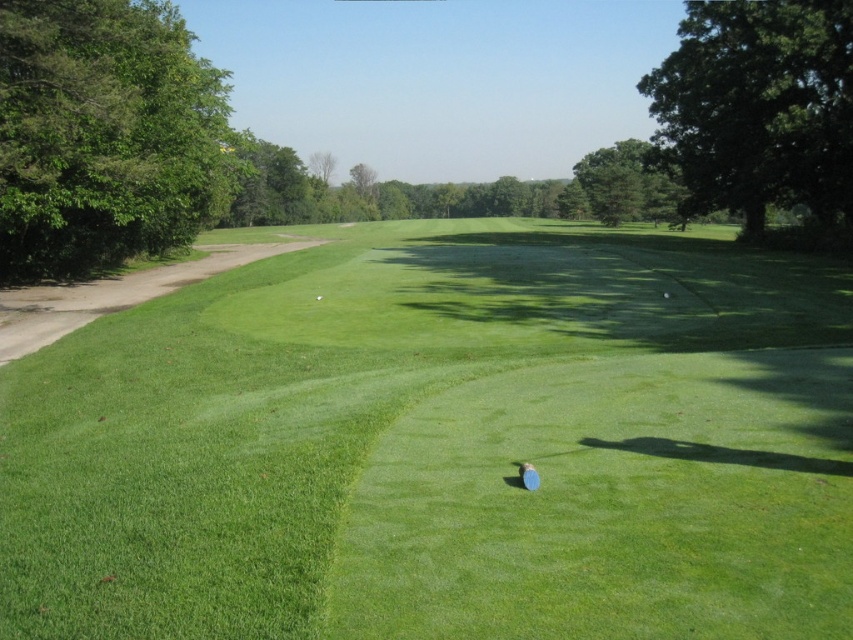
Question: Among these points, which one is farthest from the camera?

Choices:
 (A) (315, 298)
 (B) (741, 317)

Answer: (A)

Question: Which point appears closest to the camera in this image?

Choices:
 (A) (318, 296)
 (B) (532, 630)

Answer: (B)

Question: Which object appears farthest from the camera in this image?

Choices:
 (A) green grassy golf course at center
 (B) green rubber golf ball at center

Answer: (B)

Question: Can you confirm if green grassy golf course at center is thinner than green rubber golf ball at center?

Choices:
 (A) no
 (B) yes

Answer: (A)

Question: Does green grassy golf course at center appear on the right side of green rubber golf ball at center?

Choices:
 (A) no
 (B) yes

Answer: (B)

Question: In this image, where is green grassy golf course at center located relative to green rubber golf ball at center?

Choices:
 (A) left
 (B) right

Answer: (B)